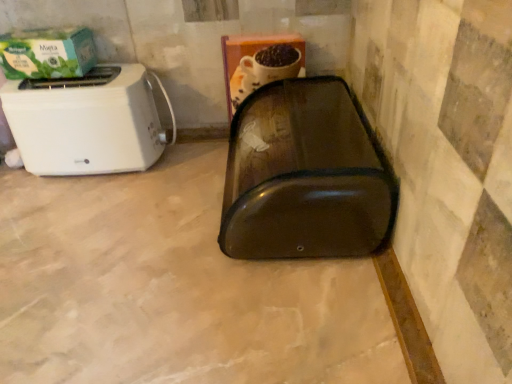
Question: Can you confirm if green matte box at upper left is thinner than white plastic toaster at left?

Choices:
 (A) no
 (B) yes

Answer: (B)

Question: Does green matte box at upper left have a lesser height compared to white plastic toaster at left?

Choices:
 (A) no
 (B) yes

Answer: (B)

Question: From a real-world perspective, is green matte box at upper left located higher than white plastic toaster at left?

Choices:
 (A) no
 (B) yes

Answer: (B)

Question: From the image's perspective, is green matte box at upper left on top of white plastic toaster at left?

Choices:
 (A) yes
 (B) no

Answer: (A)

Question: Is green matte box at upper left smaller than white plastic toaster at left?

Choices:
 (A) no
 (B) yes

Answer: (B)

Question: Looking at their shapes, would you say green matte box at upper left is wider or thinner than transparent plastic bread bin at center?

Choices:
 (A) thin
 (B) wide

Answer: (A)

Question: Do you think green matte box at upper left is within transparent plastic bread bin at center, or outside of it?

Choices:
 (A) outside
 (B) inside

Answer: (A)

Question: Is point (52, 51) positioned closer to the camera than point (74, 362)?

Choices:
 (A) closer
 (B) farther

Answer: (B)

Question: In the image, is green matte box at upper left positioned in front of or behind transparent plastic bread bin at center?

Choices:
 (A) front
 (B) behind

Answer: (B)

Question: Considering the positions of transparent plastic bread bin at center and white plastic toaster at left in the image, is transparent plastic bread bin at center taller or shorter than white plastic toaster at left?

Choices:
 (A) short
 (B) tall

Answer: (B)

Question: From a real-world perspective, is transparent plastic bread bin at center positioned above or below white plastic toaster at left?

Choices:
 (A) below
 (B) above

Answer: (A)

Question: Considering their positions, is transparent plastic bread bin at center located in front of or behind white plastic toaster at left?

Choices:
 (A) behind
 (B) front

Answer: (B)

Question: In the image, is transparent plastic bread bin at center on the left side or the right side of white plastic toaster at left?

Choices:
 (A) right
 (B) left

Answer: (B)

Question: Is white plastic toaster at left bigger or smaller than transparent plastic bread bin at center?

Choices:
 (A) small
 (B) big

Answer: (A)

Question: From their relative heights in the image, would you say white plastic toaster at left is taller or shorter than transparent plastic bread bin at center?

Choices:
 (A) tall
 (B) short

Answer: (A)